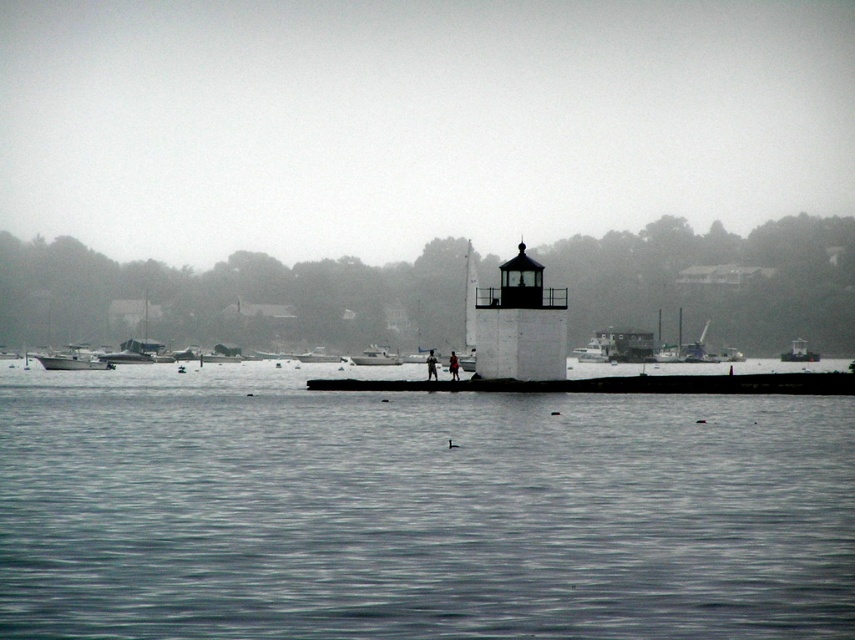
How far apart are white plastic boat at center and white fiberglass boat at center?

They are 51.40 feet apart.

Who is more forward, (591, 353) or (398, 355)?

Point (591, 353) is in front.

Where is `white plastic boat at center`? This screenshot has width=855, height=640. white plastic boat at center is located at coordinates (594, 349).

Between black matte/lightweight tower at center and white matte boat at left, which one appears on the right side from the viewer's perspective?

black matte/lightweight tower at center

The width and height of the screenshot is (855, 640). What do you see at coordinates (520, 324) in the screenshot?
I see `black matte/lightweight tower at center` at bounding box center [520, 324].

Image resolution: width=855 pixels, height=640 pixels. Find the location of `black matte/lightweight tower at center`. black matte/lightweight tower at center is located at coordinates (520, 324).

Is smooth water at center positioned at the back of white plastic boat at center?

No, it is in front of white plastic boat at center.

This screenshot has height=640, width=855. I want to click on smooth water at center, so click(416, 509).